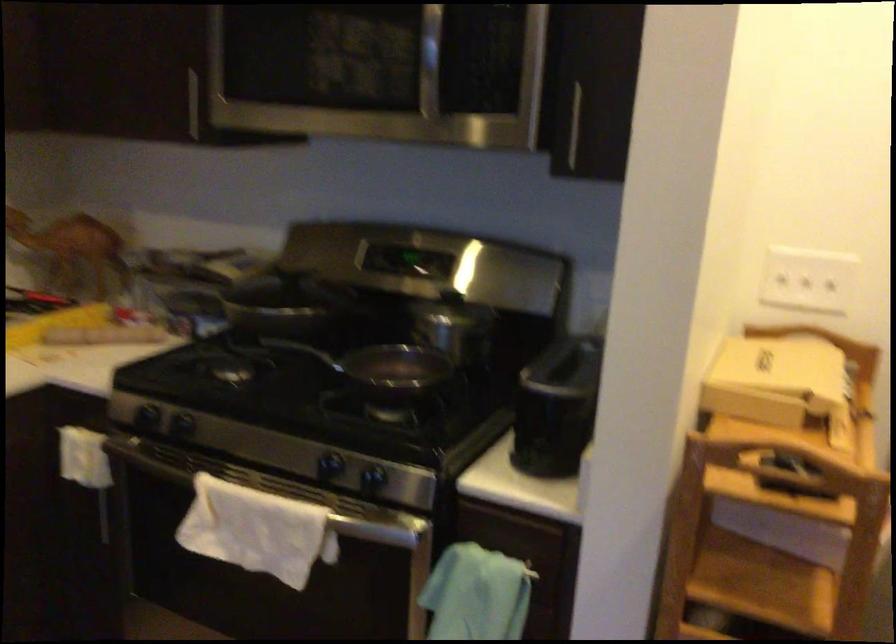
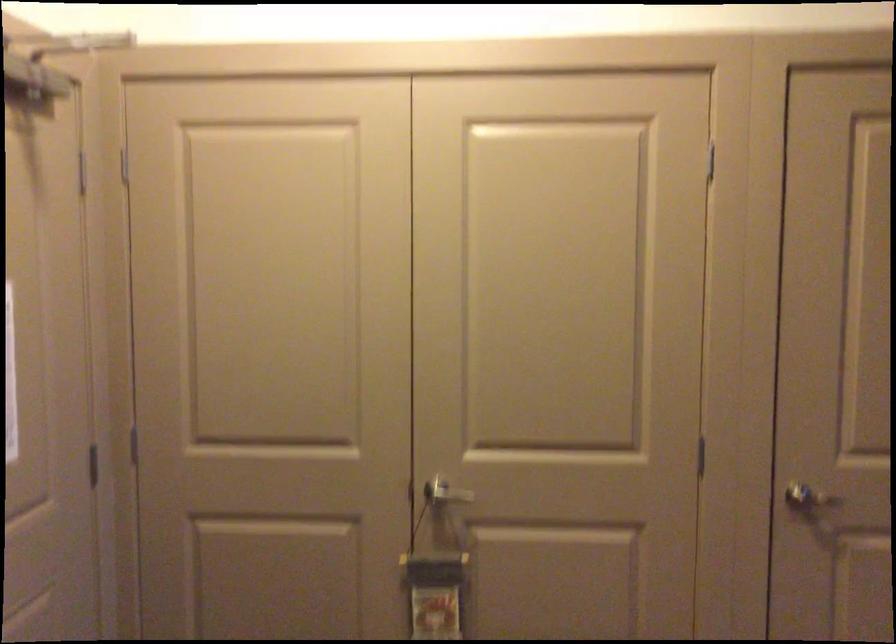
The images are taken continuously from a first-person perspective. In which direction is your viewpoint rotating?

The camera's rotation is toward right-down.